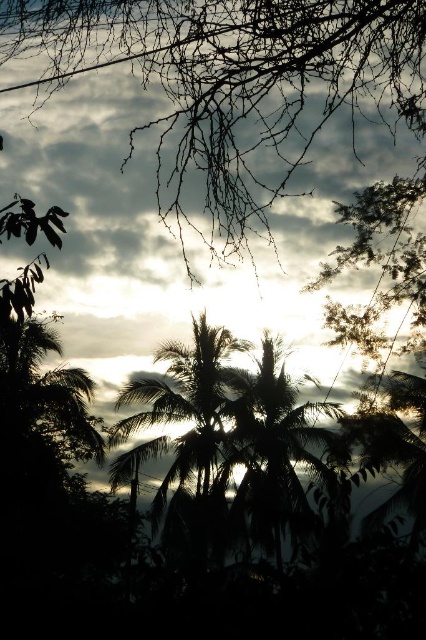
Question: From the image, what is the correct spatial relationship of cloudy sky at upper center in relation to silhouette palm tree at center?

Choices:
 (A) right
 (B) left

Answer: (A)

Question: Estimate the real-world distances between objects in this image. Which object is farther from the silhouette leafy palm at center?

Choices:
 (A) cloudy sky at upper center
 (B) silhouette palm tree at center

Answer: (A)

Question: Estimate the real-world distances between objects in this image. Which object is closer to the silhouette leafy palm at center?

Choices:
 (A) silhouette palm tree at center
 (B) cloudy sky at upper center

Answer: (A)

Question: Estimate the real-world distances between objects in this image. Which object is closer to the cloudy sky at upper center?

Choices:
 (A) silhouette palm tree at center
 (B) silhouette leafy palm at center

Answer: (B)

Question: Does cloudy sky at upper center appear on the right side of silhouette leafy palm at center?

Choices:
 (A) no
 (B) yes

Answer: (A)

Question: Can you confirm if silhouette leafy palm at center is positioned to the left of silhouette palm tree at center?

Choices:
 (A) no
 (B) yes

Answer: (A)